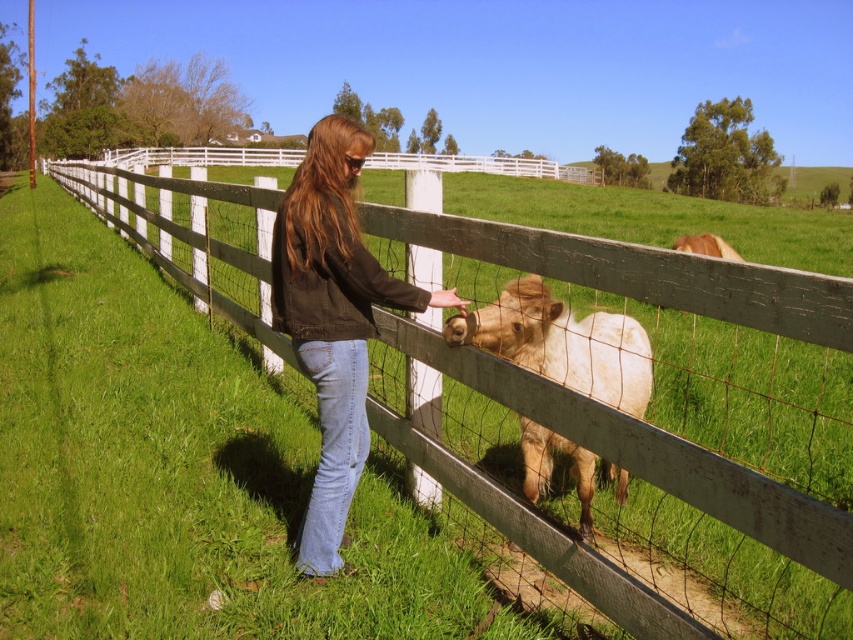
Can you confirm if white wooden fence at center is positioned below white woolen calf at center?

Actually, white wooden fence at center is above white woolen calf at center.

Between white wooden fence at center and white woolen calf at center, which one has more height?

Standing taller between the two is white wooden fence at center.

You are a GUI agent. You are given a task and a screenshot of the screen. Output one action in this format:
    pyautogui.click(x=<x>, y=<y>)
    Task: Click on the white wooden fence at center
    Image resolution: width=853 pixels, height=640 pixels.
    Given the screenshot: What is the action you would take?
    pyautogui.click(x=639, y=432)

This screenshot has width=853, height=640. I want to click on white wooden fence at center, so click(x=639, y=432).

Is point (318, 240) farther from camera compared to point (569, 445)?

No, it is in front of (569, 445).

Which of these two, denim jacket at center or white woolen calf at center, stands shorter?

With less height is white woolen calf at center.

Does point (360, 141) come behind point (630, 316)?

No, (360, 141) is closer to viewer.

Identify the location of denim jacket at center. The width and height of the screenshot is (853, 640). (334, 317).

Between white wooden fence at center and denim jacket at center, which one is positioned lower?

Positioned lower is denim jacket at center.

Measure the distance between white wooden fence at center and camera.

white wooden fence at center and camera are 4.21 feet apart.

You are a GUI agent. You are given a task and a screenshot of the screen. Output one action in this format:
    pyautogui.click(x=<x>, y=<y>)
    Task: Click on the white wooden fence at center
    The image size is (853, 640).
    Given the screenshot: What is the action you would take?
    pyautogui.click(x=639, y=432)